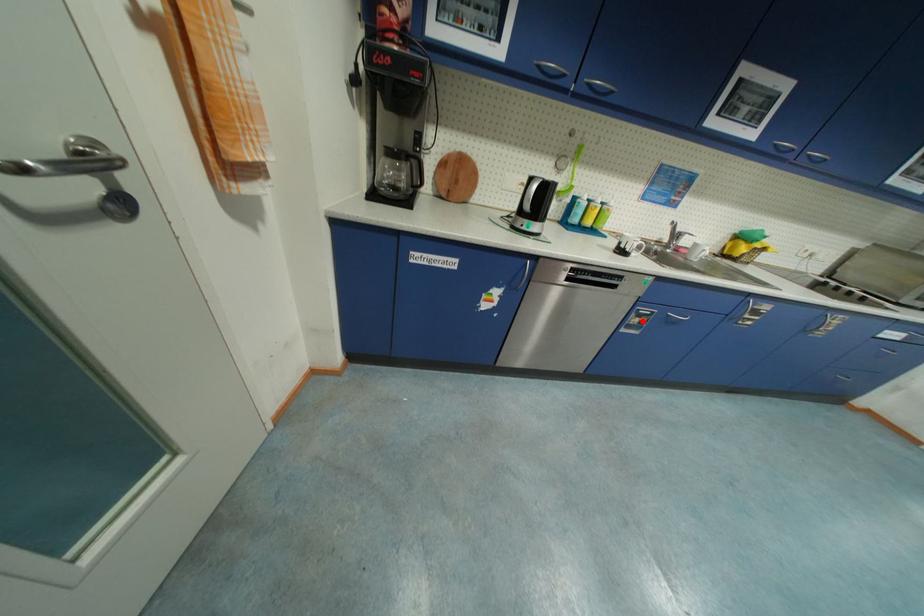
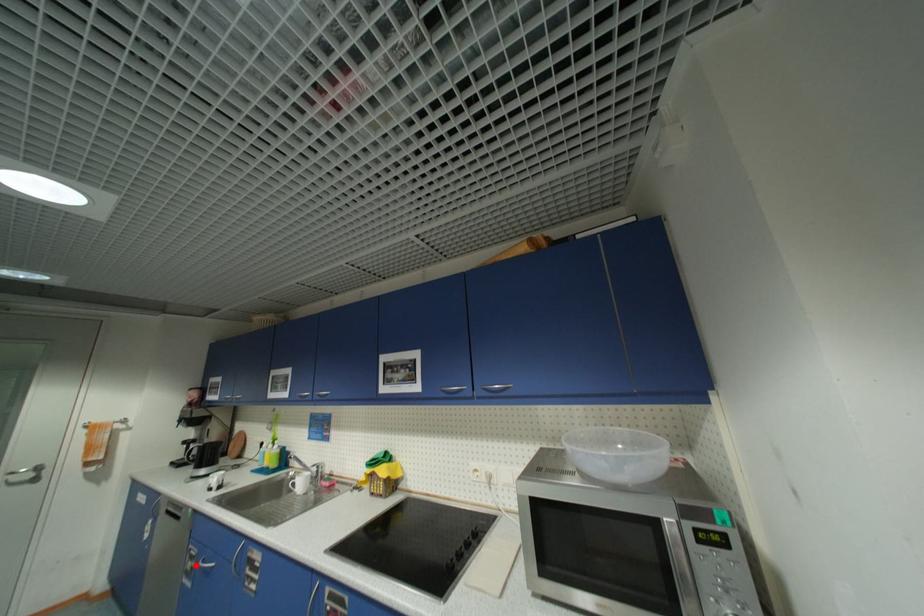
I am providing you with two images of the same scene from different viewpoints. A red point is marked on the first image and another point is marked on the second image. Do the highlighted points in image1 and image2 indicate the same real-world spot?

Yes